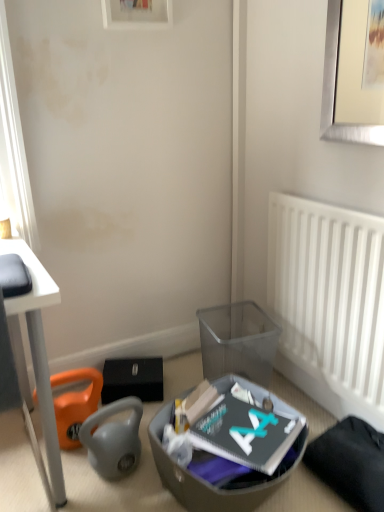
Question: Based on their positions, is transparent plastic trash bin/can at lower center located to the left or right of orange fabric bean bag chair at lower left?

Choices:
 (A) left
 (B) right

Answer: (B)

Question: From a real-world perspective, is transparent plastic trash bin/can at lower center above or below orange fabric bean bag chair at lower left?

Choices:
 (A) below
 (B) above

Answer: (B)

Question: Based on their relative distances, which object is farther from the white plastic radiator at right?

Choices:
 (A) orange fabric bean bag chair at lower left
 (B) translucent plastic shoe box at lower center
 (C) wooden picture frame at upper center
 (D) transparent plastic trash bin/can at lower center

Answer: (C)

Question: Which of these objects is positioned closest to the wooden picture frame at upper center?

Choices:
 (A) white plastic radiator at right
 (B) transparent plastic trash bin/can at lower center
 (C) translucent plastic shoe box at lower center
 (D) orange fabric bean bag chair at lower left

Answer: (A)